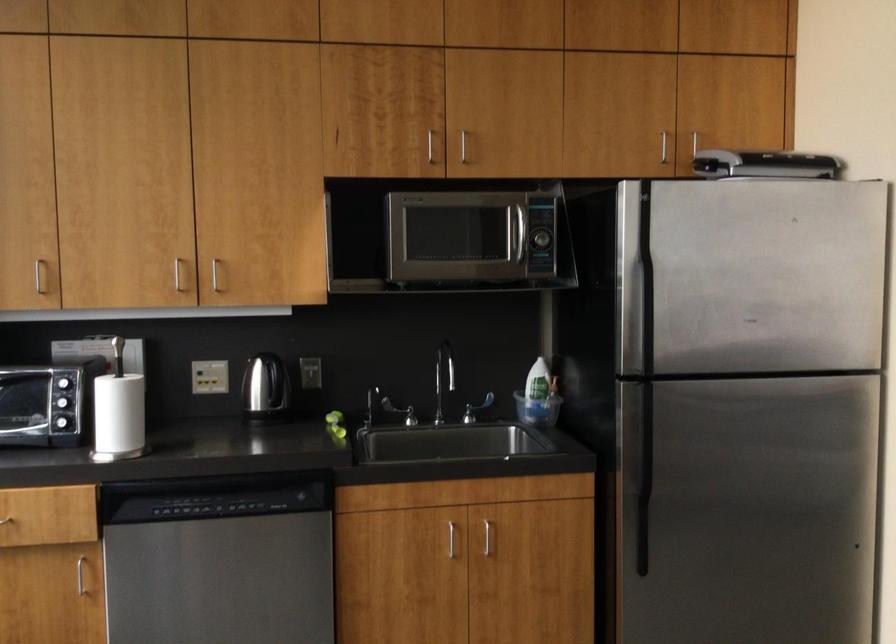
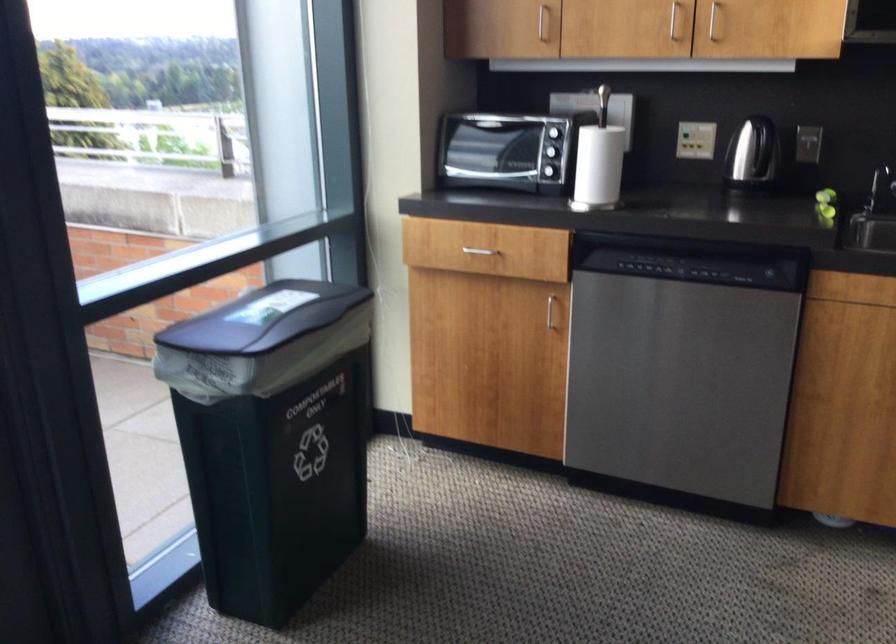
The point at (209, 381) is marked in the first image. Where is the corresponding point in the second image?

(695, 140)